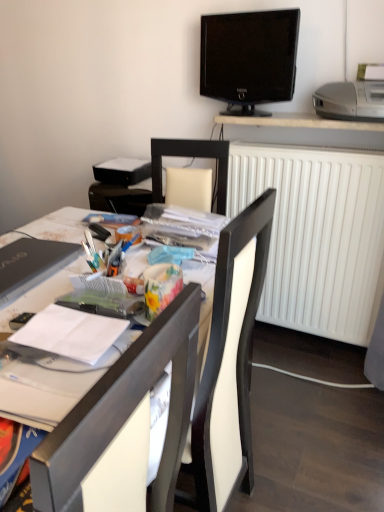
Question: From their relative heights in the image, would you say white glossy desk at upper center is taller or shorter than black glossy tv at upper center?

Choices:
 (A) tall
 (B) short

Answer: (B)

Question: Relative to black glossy tv at upper center, is white glossy desk at upper center in front or behind?

Choices:
 (A) front
 (B) behind

Answer: (B)

Question: Which of these objects is positioned farthest from the white glossy computer desk at center?

Choices:
 (A) black glossy tv at upper center
 (B) white matte radiator at right
 (C) matte black laptop at left
 (D) white paper at center
 (E) white glossy desk at upper center

Answer: (E)

Question: Which of these objects is positioned farthest from the white paper at center?

Choices:
 (A) white matte radiator at right
 (B) black glossy tv at upper center
 (C) silver metallic printer at upper right
 (D) white plastic chair at center
 (E) matte black laptop at left

Answer: (B)